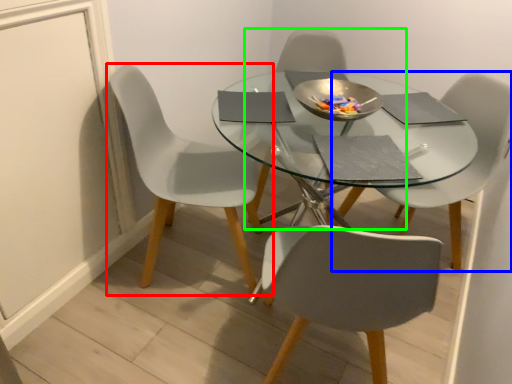
Question: Based on their relative distances, which object is nearer to chair (highlighted by a red box)? Choose from chair (highlighted by a blue box) and chair (highlighted by a green box).

Choices:
 (A) chair
 (B) chair

Answer: (B)